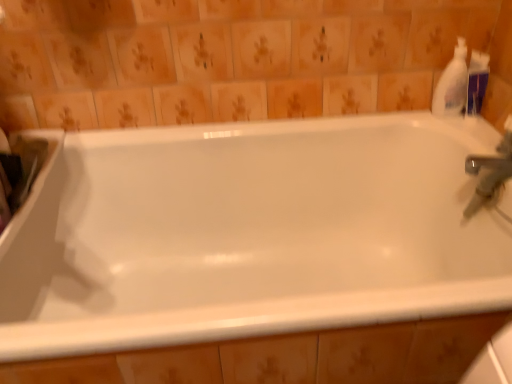
The width and height of the screenshot is (512, 384). In order to click on free region on the left part of white plastic bottle at upper right in this screenshot , I will do `click(396, 117)`.